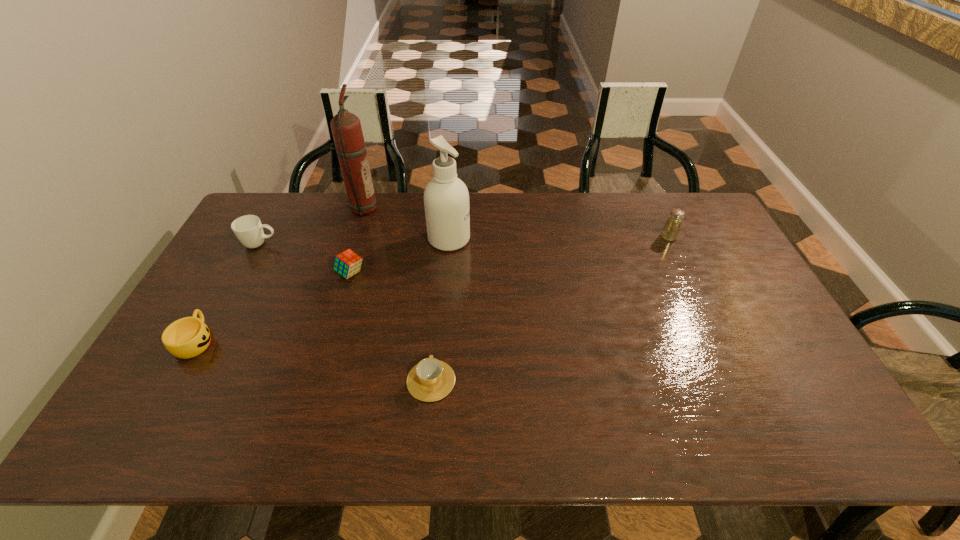
In the image, there is a desktop. What are the coordinates of `free space at the far edge` in the screenshot? It's located at tap(597, 228).

At what (x,y) coordinates should I click in order to perform the action: click on blank space at the left edge of the desktop. Please return your answer as a coordinate pair (x, y). The height and width of the screenshot is (540, 960). Looking at the image, I should click on (230, 328).

In the image, there is a desktop. What are the coordinates of `free region at the right edge` in the screenshot? It's located at (725, 295).

Locate an element on the screen. The image size is (960, 540). vacant space at the near left corner of the desktop is located at coordinates (141, 442).

I want to click on free spot between the rightmost cup and the third tallest object, so click(550, 309).

At what (x,y) coordinates should I click in order to perform the action: click on vacant point located between the sixth shortest object and the farthest cup. Please return your answer as a coordinate pair (x, y). Image resolution: width=960 pixels, height=540 pixels. Looking at the image, I should click on (355, 241).

The height and width of the screenshot is (540, 960). In order to click on vacant area that lies between the third nearest object and the rightmost cup in this screenshot , I will do `click(391, 327)`.

In order to click on free spot between the rightmost object and the third nearest object in this screenshot , I will do `click(510, 255)`.

Where is `unoccupied area between the saltshaker and the cube`? The image size is (960, 540). unoccupied area between the saltshaker and the cube is located at coordinates (510, 255).

Locate which object is the fourth closest to the fifth shortest object. Please provide its 2D coordinates. Your answer should be formatted as a tuple, i.e. [(x, y)], where the tuple contains the x and y coordinates of a point satisfying the conditions above.

[(346, 128)]